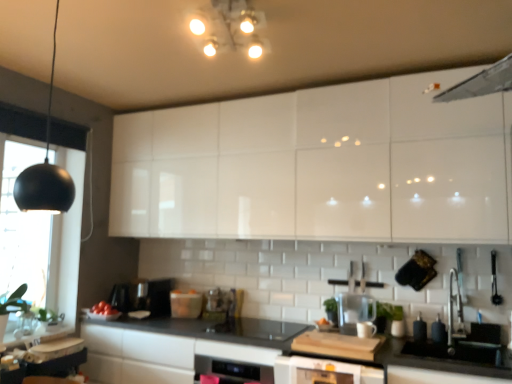
The height and width of the screenshot is (384, 512). Identify the location of white glossy light fixture at upper center, marked as the 2th light fixture in a front-to-back arrangement. (228, 27).

Image resolution: width=512 pixels, height=384 pixels. What do you see at coordinates (143, 296) in the screenshot?
I see `satin black coffee machine at center` at bounding box center [143, 296].

Image resolution: width=512 pixels, height=384 pixels. What do you see at coordinates (457, 310) in the screenshot? I see `satin nickel faucet at lower right` at bounding box center [457, 310].

The image size is (512, 384). What do you see at coordinates (168, 350) in the screenshot? I see `black matte countertop at center` at bounding box center [168, 350].

This screenshot has width=512, height=384. Identify the location of matte black soap dispenser at lower right, which is the 1th appliance in right-to-left order. (419, 329).

Does point (152, 210) appear closer or farther from the camera than point (459, 295)?

Point (152, 210) is farther from the camera than point (459, 295).

Who is smaller, white glossy cabinets at upper center or satin nickel faucet at lower right?

With smaller size is satin nickel faucet at lower right.

Considering the sizes of objects white glossy cabinets at upper center and satin nickel faucet at lower right in the image provided, who is wider, white glossy cabinets at upper center or satin nickel faucet at lower right?

Wider between the two is white glossy cabinets at upper center.

This screenshot has width=512, height=384. I want to click on silver behind the white glossy cabinets at upper center, so click(x=457, y=310).

Is black matte light fixture at left, which is the second light fixture from back to front, shorter than matte plastic container at center, positioned as the 1th appliance in left-to-right order?

No, black matte light fixture at left, which is the second light fixture from back to front, is not shorter than matte plastic container at center, positioned as the 1th appliance in left-to-right order.

How many degrees apart are the facing directions of black matte light fixture at left, which is the 1th light fixture in front-to-back order, and matte plastic container at center, the third appliance from the front?

The angular difference between black matte light fixture at left, which is the 1th light fixture in front-to-back order, and matte plastic container at center, the third appliance from the front, is 34.6 degrees.

From a real-world perspective, is black matte light fixture at left, which is the second light fixture from back to front, physically below matte plastic container at center, positioned as the 1th appliance in left-to-right order?

No, from a real-world perspective, black matte light fixture at left, which is the second light fixture from back to front, is not below matte plastic container at center, positioned as the 1th appliance in left-to-right order.

How far apart are black matte light fixture at left, the 2th light fixture in the top-to-bottom sequence, and matte plastic container at center, the third appliance from the front?

The distance of black matte light fixture at left, the 2th light fixture in the top-to-bottom sequence, from matte plastic container at center, the third appliance from the front, is 1.34 meters.

Between transparent plastic water filter at center, positioned as the 2th appliance in front-to-back order, and black matte countertop at center, which one appears on the right side from the viewer's perspective?

transparent plastic water filter at center, positioned as the 2th appliance in front-to-back order.

Is black matte countertop at center at the back of transparent plastic water filter at center, the 3th appliance viewed from the left?

No.

Is black matte countertop at center inside transparent plastic water filter at center, the 3th appliance viewed from the left?

No, black matte countertop at center is not a part of transparent plastic water filter at center, the 3th appliance viewed from the left.

Is black matte lampshade at left not close to black matte light fixture at left, the 1th light fixture from the left?

black matte lampshade at left is far away from black matte light fixture at left, the 1th light fixture from the left.

Is black matte lampshade at left wider than black matte light fixture at left, which is the first light fixture from bottom to top?

No.

Could you tell me if black matte lampshade at left is turned towards black matte light fixture at left, the 2th light fixture in the top-to-bottom sequence?

No.

From the image's perspective, which object appears higher, black matte lampshade at left or black matte light fixture at left, which is the second light fixture from back to front?

→ black matte light fixture at left, which is the second light fixture from back to front, from the image's perspective.

Is black matte light fixture at left, which is the first light fixture from bottom to top, aimed at satin nickel faucet at lower right?

No.

Which is in front, black matte light fixture at left, the 2th light fixture in the top-to-bottom sequence, or satin nickel faucet at lower right?

Positioned in front is black matte light fixture at left, the 2th light fixture in the top-to-bottom sequence.

In order to click on light fixture that is the 1st one above the satin nickel faucet at lower right (from a real-world perspective) in this screenshot , I will do `click(45, 172)`.

Is black matte light fixture at left, which is the second light fixture from back to front, in contact with satin nickel faucet at lower right?

black matte light fixture at left, which is the second light fixture from back to front, and satin nickel faucet at lower right are clearly separated.

From the image's perspective, between white glossy oven at lower center and black matte countertop at center, who is located below?

black matte countertop at center is shown below in the image.

Considering the sizes of objects white glossy oven at lower center and black matte countertop at center in the image provided, who is bigger, white glossy oven at lower center or black matte countertop at center?

Bigger between the two is black matte countertop at center.

Is white glossy oven at lower center behind black matte countertop at center?

Yes, white glossy oven at lower center is further from the camera.

Considering the relative positions of black matte countertop at center and white glossy cabinets at upper center in the image provided, is black matte countertop at center behind white glossy cabinets at upper center?

No, black matte countertop at center is closer to the viewer.

Who is shorter, black matte countertop at center or white glossy cabinets at upper center?

With less height is black matte countertop at center.

From the image's perspective, which is above, black matte countertop at center or white glossy cabinets at upper center?

white glossy cabinets at upper center, from the image's perspective.

The width and height of the screenshot is (512, 384). Identify the location of cabinetry in front of the satin nickel faucet at lower right. (318, 166).

The image size is (512, 384). I want to click on the 4th appliance below the black matte light fixture at left, which is the first light fixture from bottom to top (from the image's perspective), so click(185, 304).

Based on their spatial positions, is satin nickel faucet at lower right or white glossy dishwasher at center closer to black matte light fixture at left, the 1th light fixture from the left?

The object closer to black matte light fixture at left, the 1th light fixture from the left, is white glossy dishwasher at center.

When comparing their distances from satin black coffee machine at center, does white glossy light fixture at upper center, the 1th light fixture positioned from the right, or white glossy dishwasher at center seem further?

The object further to satin black coffee machine at center is white glossy light fixture at upper center, the 1th light fixture positioned from the right.

When comparing their distances from black matte light fixture at left, which is the first light fixture from bottom to top, does satin black coffee machine at center or white glossy light fixture at upper center, arranged as the 1th light fixture when viewed from the back, seem closer?

Among the two, satin black coffee machine at center is located nearer to black matte light fixture at left, which is the first light fixture from bottom to top.

Looking at the image, which one is located further to metallic glass jar at center, marked as the 4th appliance in a front-to-back arrangement, black matte lampshade at left or black matte countertop at center?

black matte lampshade at left.

Looking at the image, which one is located further to matte plastic container at center, the fourth appliance when ordered from right to left, matte black soap dispenser at lower right, placed as the first appliance when sorted from front to back, or metallic glass jar at center, which is the 1th appliance from back to front?

matte black soap dispenser at lower right, placed as the first appliance when sorted from front to back.

When comparing their distances from matte black soap dispenser at lower right, placed as the first appliance when sorted from front to back, does metallic glass jar at center, marked as the 4th appliance in a front-to-back arrangement, or black matte countertop at center seem closer?

metallic glass jar at center, marked as the 4th appliance in a front-to-back arrangement, is closer to matte black soap dispenser at lower right, placed as the first appliance when sorted from front to back.

From the image, which object appears to be nearer to metallic glass jar at center, which is counted as the third appliance, starting from the right, satin nickel faucet at lower right or black matte light fixture at left, which is the 1th light fixture in front-to-back order?

black matte light fixture at left, which is the 1th light fixture in front-to-back order, is positioned closer to the anchor metallic glass jar at center, which is counted as the third appliance, starting from the right.

Based on their spatial positions, is white glossy dishwasher at center or metallic glass jar at center, which is the 1th appliance from back to front, further from transparent plastic water filter at center, the 3th appliance viewed from the back?

Based on the image, metallic glass jar at center, which is the 1th appliance from back to front, appears to be further to transparent plastic water filter at center, the 3th appliance viewed from the back.

I want to click on light fixture between matte plastic container at center, positioned as the 1th appliance in left-to-right order, and satin nickel faucet at lower right, in the horizontal direction, so click(228, 27).

Find the location of a particular element. This screenshot has height=384, width=512. window screen between white glossy light fixture at upper center, arranged as the 1th light fixture when viewed from the back, and white glossy dishwasher at center in the up-down direction is located at coordinates (23, 231).

Locate an element on the screen. cabinetry situated between matte plastic container at center, the third appliance from the front, and matte black soap dispenser at lower right, the fourth appliance positioned from the back, from left to right is located at coordinates (318, 166).

Where is `dish washer located between metallic glass jar at center, which is the 1th appliance from back to front, and transparent plastic water filter at center, the 2th appliance viewed from the right, in the left-right direction`? The image size is (512, 384). dish washer located between metallic glass jar at center, which is the 1th appliance from back to front, and transparent plastic water filter at center, the 2th appliance viewed from the right, in the left-right direction is located at coordinates (234, 361).